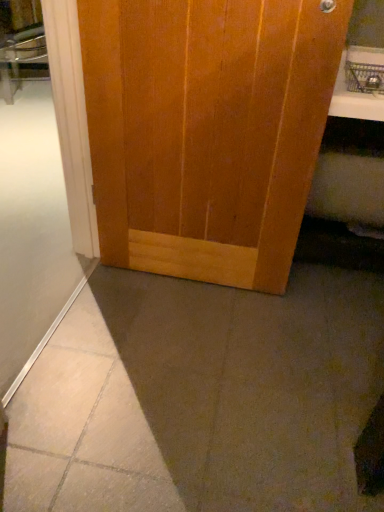
Question: Is wooden door at center at the back of white frosted glass at lower left?

Choices:
 (A) no
 (B) yes

Answer: (A)

Question: Considering the relative positions of white frosted glass at lower left and wooden door at center in the image provided, is white frosted glass at lower left to the right of wooden door at center from the viewer's perspective?

Choices:
 (A) no
 (B) yes

Answer: (A)

Question: Is white frosted glass at lower left behind wooden door at center?

Choices:
 (A) yes
 (B) no

Answer: (B)

Question: Does white frosted glass at lower left have a lesser height compared to wooden door at center?

Choices:
 (A) yes
 (B) no

Answer: (A)

Question: Can you confirm if white frosted glass at lower left is bigger than wooden door at center?

Choices:
 (A) yes
 (B) no

Answer: (A)

Question: Is there a large distance between white frosted glass at lower left and wooden door at center?

Choices:
 (A) yes
 (B) no

Answer: (B)

Question: Is wooden door at center at the right side of white glossy counter top at upper right?

Choices:
 (A) yes
 (B) no

Answer: (B)

Question: Does wooden door at center have a greater width compared to white glossy counter top at upper right?

Choices:
 (A) no
 (B) yes

Answer: (A)

Question: From a real-world perspective, is wooden door at center on white glossy counter top at upper right?

Choices:
 (A) no
 (B) yes

Answer: (A)

Question: Does wooden door at center appear on the left side of white glossy counter top at upper right?

Choices:
 (A) no
 (B) yes

Answer: (B)

Question: Can you confirm if wooden door at center is taller than white glossy counter top at upper right?

Choices:
 (A) no
 (B) yes

Answer: (B)

Question: Is wooden door at center positioned beyond the bounds of white glossy counter top at upper right?

Choices:
 (A) yes
 (B) no

Answer: (A)

Question: Considering the relative sizes of wooden door at center and white frosted glass at lower left in the image provided, is wooden door at center thinner than white frosted glass at lower left?

Choices:
 (A) yes
 (B) no

Answer: (A)